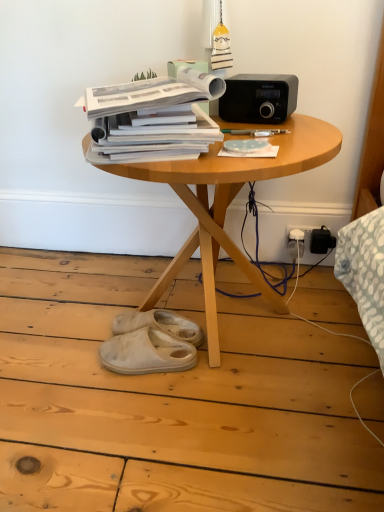
I want to click on free space in front of black matte stereo at upper right, so click(280, 131).